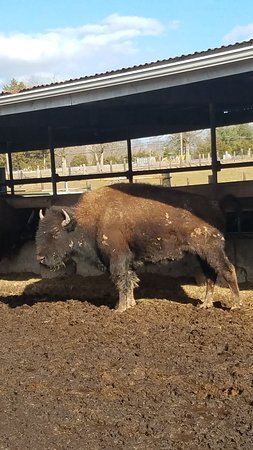
This screenshot has width=253, height=450. What are the coordinates of `left front leg` in the screenshot? It's located at (122, 269).